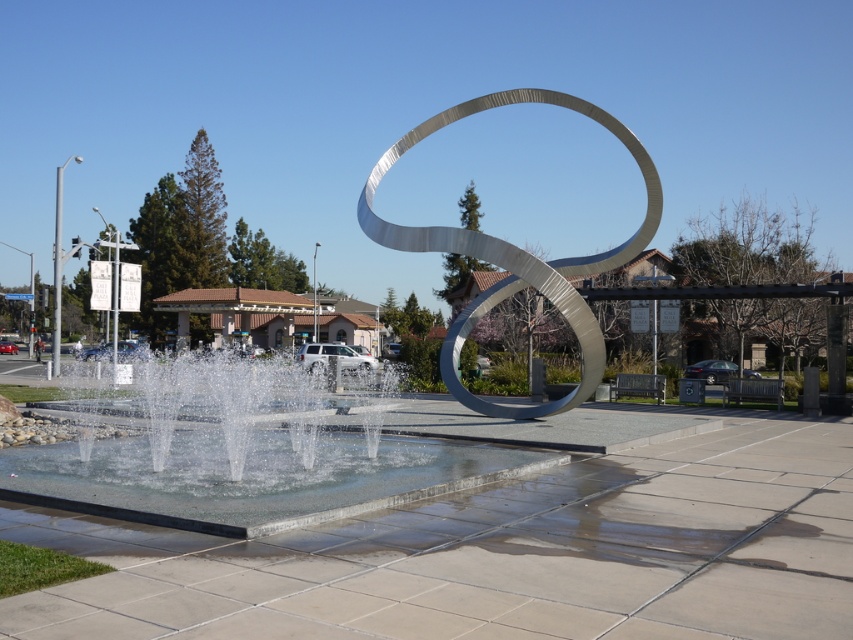
Can you confirm if clear glass water at center is wider than clear water at center?

Indeed, clear glass water at center has a greater width compared to clear water at center.

Who is positioned more to the left, clear glass water at center or clear water at center?

From the viewer's perspective, clear glass water at center appears more on the left side.

Is point (283, 372) positioned behind point (242, 394)?

Yes, point (283, 372) is farther from viewer.

Identify the location of clear glass water at center. (248, 452).

Which is below, clear glass water at center or silver metallic sculpture at center?

Positioned lower is clear glass water at center.

Where is `clear glass water at center`? This screenshot has width=853, height=640. clear glass water at center is located at coordinates (248, 452).

Does point (358, 433) come in front of point (553, 100)?

Yes.

At what (x,y) coordinates should I click in order to perform the action: click on clear glass water at center. Please return your answer as a coordinate pair (x, y). Looking at the image, I should click on (248, 452).

Does clear water at center have a greater width compared to silver metallic sculpture at center?

No, clear water at center is not wider than silver metallic sculpture at center.

In the scene shown: Is clear water at center further to the viewer compared to silver metallic sculpture at center?

No, it is in front of silver metallic sculpture at center.

Between point (242, 468) and point (440, 356), which one is positioned behind?

The point (440, 356) is behind.

The image size is (853, 640). I want to click on clear water at center, so click(230, 429).